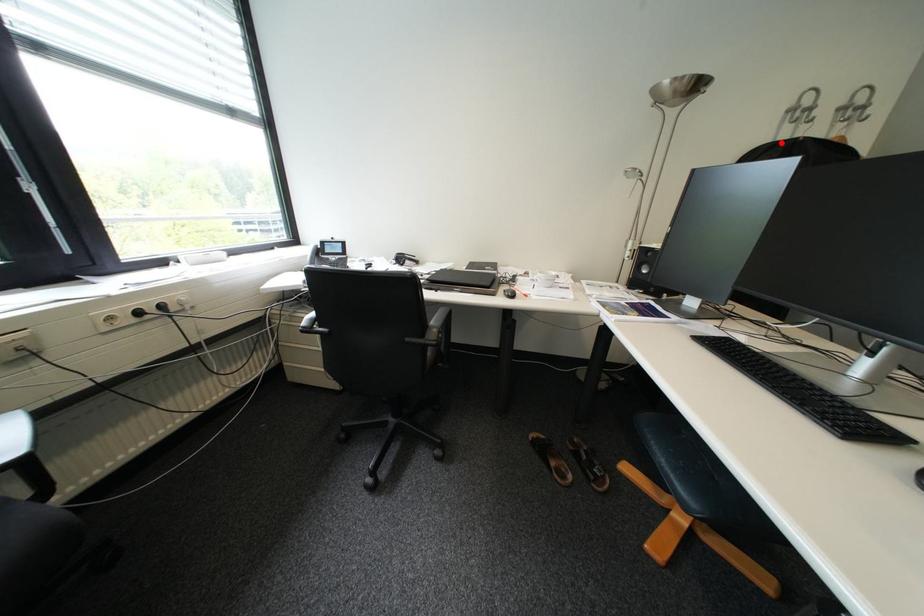
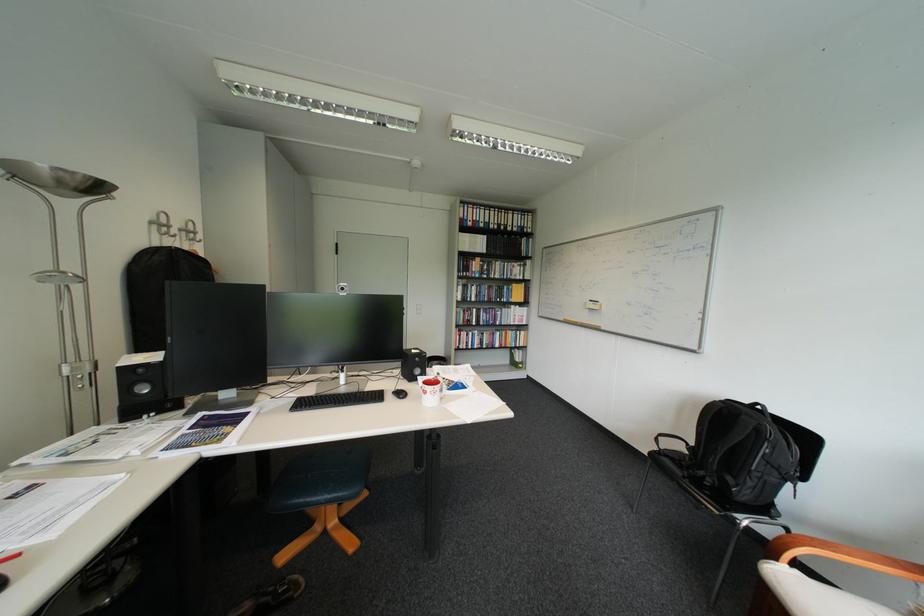
Find the pixel in the second image that matches the highlighted location in the first image.

(160, 246)